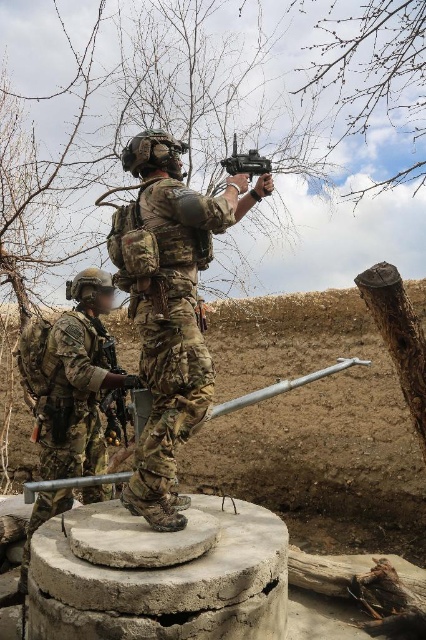
You are a drone operator observing the two soldiers in the scene. You notice two points marked in the image. The first point is at coordinate point (131,380) and the second point is at coordinate point (247,170). Which point is closer to the soldier in the foreground?

Point (247,170) is closer to the soldier in the foreground because it is in front of point (131,380), which is behind it.

You are a drone operator observing the scene. You notice the camouflage fabric uniform at center and the matte black rifle at upper center. Which object is positioned closer to your line of sight?

The camouflage fabric uniform at center is closer to the viewer than the matte black rifle at upper center, so the camouflage fabric uniform at center is positioned closer to your line of sight.

You are a drone operator observing the scene. You need to determine which object is taller between the camouflage uniform at center and the matte black rifle at upper center. Which one is taller?

The camouflage uniform at center is taller than the matte black rifle at upper center according to the description.